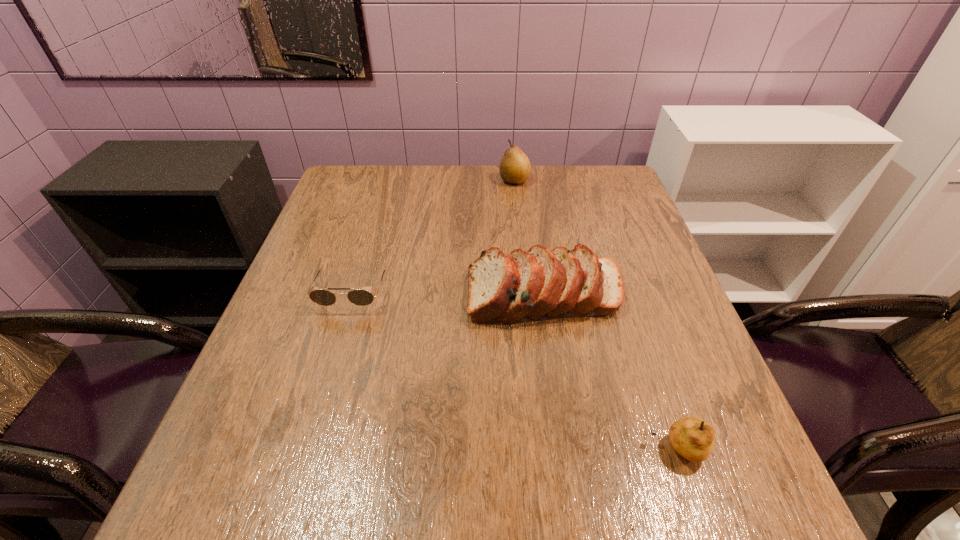
I want to click on free space at the far right corner of the desktop, so click(x=628, y=193).

The height and width of the screenshot is (540, 960). Identify the location of vacant area between the second shortest object and the bread. point(612,372).

You are a GUI agent. You are given a task and a screenshot of the screen. Output one action in this format:
    pyautogui.click(x=<x>, y=<y>)
    Task: Click on the vacant point located between the nearer pear and the leftmost object
    This screenshot has height=540, width=960.
    Given the screenshot: What is the action you would take?
    pyautogui.click(x=515, y=370)

The width and height of the screenshot is (960, 540). In order to click on free space between the nearest object and the bread in this screenshot , I will do `click(612, 372)`.

You are a GUI agent. You are given a task and a screenshot of the screen. Output one action in this format:
    pyautogui.click(x=<x>, y=<y>)
    Task: Click on the free space between the farthest object and the shortest object
    
    Given the screenshot: What is the action you would take?
    pyautogui.click(x=433, y=236)

Image resolution: width=960 pixels, height=540 pixels. In order to click on free area in between the shortest object and the bread in this screenshot , I will do point(449,293).

You are a GUI agent. You are given a task and a screenshot of the screen. Output one action in this format:
    pyautogui.click(x=<x>, y=<y>)
    Task: Click on the free space between the right pear and the bread
    
    Given the screenshot: What is the action you would take?
    pyautogui.click(x=612, y=372)

The height and width of the screenshot is (540, 960). What are the coordinates of `free space between the shortest object and the taller pear` in the screenshot? It's located at (433, 236).

This screenshot has width=960, height=540. In order to click on vacant space in between the nearest object and the bread in this screenshot , I will do `click(612, 372)`.

This screenshot has height=540, width=960. Identify the location of free spot between the shortest object and the taller pear. (433, 236).